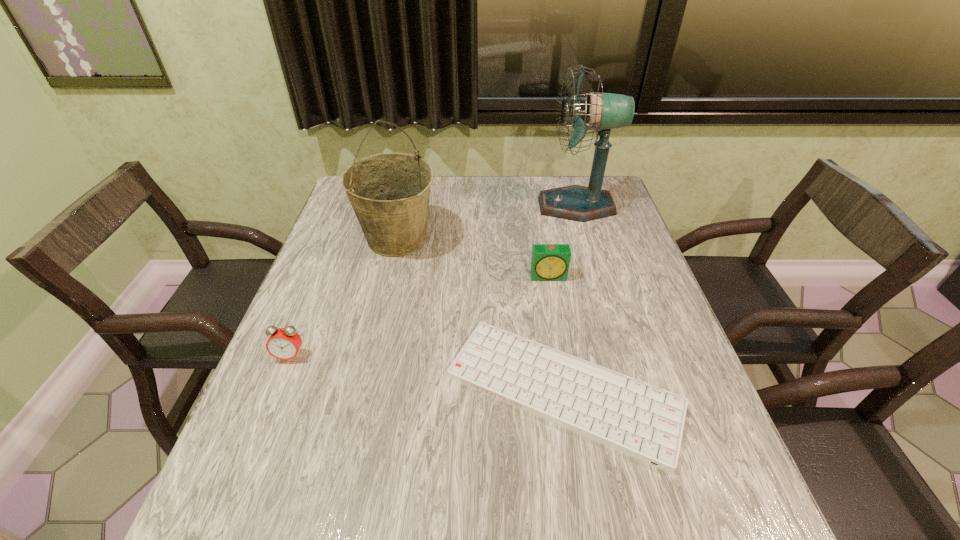
You are a GUI agent. You are given a task and a screenshot of the screen. Output one action in this format:
    pyautogui.click(x=<x>, y=<y>)
    Task: Click on the blank region between the fan and the shortest object
    The height and width of the screenshot is (540, 960).
    Given the screenshot: What is the action you would take?
    pyautogui.click(x=569, y=299)

The width and height of the screenshot is (960, 540). Identify the location of free space between the second tallest object and the farther alarm clock. (473, 258).

In order to click on free space between the tallest object and the left alarm clock in this screenshot , I will do `click(433, 281)`.

This screenshot has height=540, width=960. Identify the location of vacant region between the fan and the leftmost object. (433, 281).

You are a GUI agent. You are given a task and a screenshot of the screen. Output one action in this format:
    pyautogui.click(x=<x>, y=<y>)
    Task: Click on the free space between the nearer alarm clock and the shortest object
    The width and height of the screenshot is (960, 540).
    Given the screenshot: What is the action you would take?
    pyautogui.click(x=426, y=374)

The width and height of the screenshot is (960, 540). Identify the location of vacant region between the computer keyboard and the right alarm clock. (556, 334).

Identify the location of free point between the farther alarm clock and the shortest object. (556, 334).

Identify which object is the fourth closest to the tallest object. Please provide its 2D coordinates. Your answer should be formatted as a tuple, i.e. [(x, y)], where the tuple contains the x and y coordinates of a point satisfying the conditions above.

[(284, 343)]

You are a GUI agent. You are given a task and a screenshot of the screen. Output one action in this format:
    pyautogui.click(x=<x>, y=<y>)
    Task: Click on the object that is the closest one to the farther alarm clock
    
    Given the screenshot: What is the action you would take?
    pyautogui.click(x=643, y=421)

Locate an element on the screen. free spot that satisfies the following two spatial constraints: 1. on the front-facing side of the computer keyboard; 2. on the right side of the nearer alarm clock is located at coordinates (276, 391).